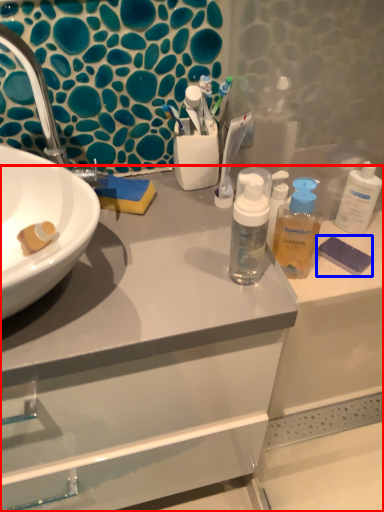
Question: Which object is further to the camera taking this photo, bathroom cabinet (highlighted by a red box) or soap (highlighted by a blue box)?

Choices:
 (A) bathroom cabinet
 (B) soap

Answer: (B)